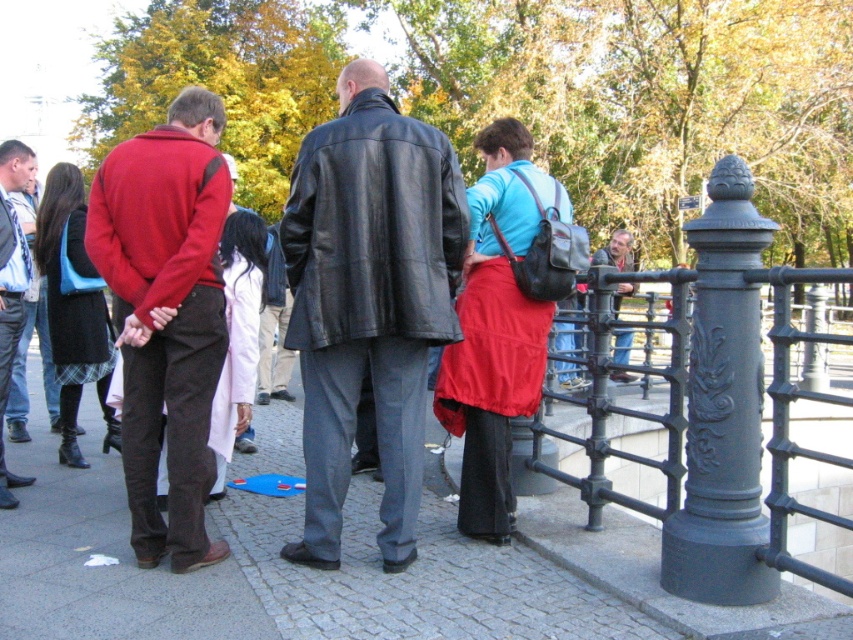
You are standing in the park and want to find the matte red sweater at left. Which direction should you look relative to the black leather jacket at center?

The matte red sweater at left is located below the black leather jacket at center, so you should look downward from the black leather jacket at center to find it.

You are a photographer trying to capture a group photo of the black leather jacket at center and the matte red jacket at left. The camera you are using has a minimum focus distance of 60 centimeters. Will you be able to take the photo without moving either jacket?

The black leather jacket at center and the matte red jacket at left are 58.74 centimeters apart from each other. Since the camera requires a minimum focus distance of 60 centimeters, the photographer cannot take the photo without moving the jackets closer together to meet the distance requirement.

You are a photographer positioned in front of the group of people in the park. You want to take a photo that includes both the matte black jacket at left and the blue jeans at right. Which object should you adjust your camera angle to focus on first to ensure both are in frame?

The matte black jacket at left is closer to you than the blue jeans at right, so you should focus on the matte black jacket at left first to ensure both are in frame.